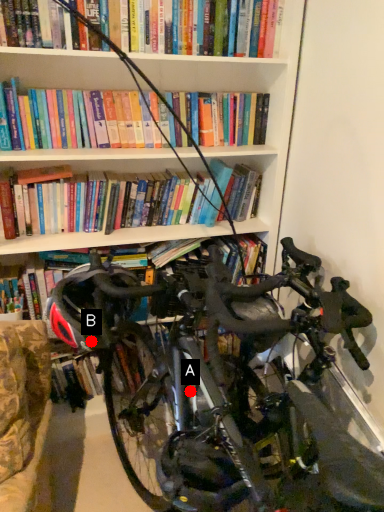
Question: Two points are circled on the image, labeled by A and B beside each circle. Which point is farther from the camera taking this photo?

Choices:
 (A) A is further
 (B) B is further

Answer: (A)